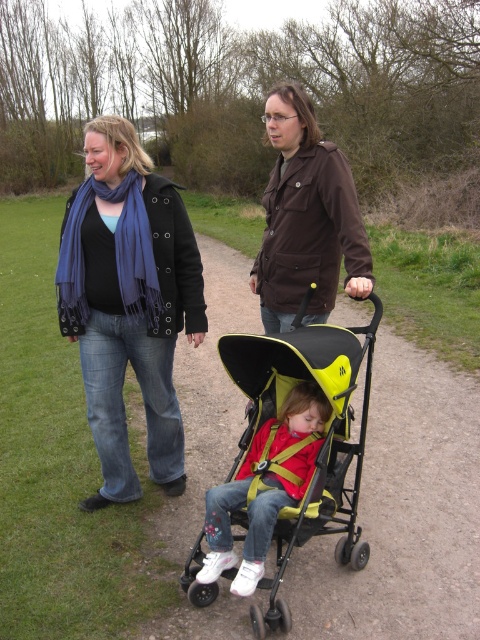
Who is positioned more to the left, matte black coat at center or matte yellow stroller at center?

matte black coat at center

The width and height of the screenshot is (480, 640). Find the location of `matte black coat at center`. matte black coat at center is located at coordinates (129, 304).

Identify the location of matte black coat at center. The image size is (480, 640). (129, 304).

Is matte black coat at center thinner than brown matte jacket at upper center?

No, matte black coat at center is not thinner than brown matte jacket at upper center.

Between matte black coat at center and brown matte jacket at upper center, which one is positioned higher?

brown matte jacket at upper center is above.

The image size is (480, 640). Identify the location of matte black coat at center. tap(129, 304).

Where is `matte black coat at center`? The height and width of the screenshot is (640, 480). matte black coat at center is located at coordinates (129, 304).

Based on the photo, can you confirm if yellow matte baby carriage at center is positioned above brown matte jacket at upper center?

Incorrect, yellow matte baby carriage at center is not positioned above brown matte jacket at upper center.

Does point (252, 392) lie in front of point (300, 179)?

Yes, it is in front of point (300, 179).

I want to click on yellow matte baby carriage at center, so click(322, 436).